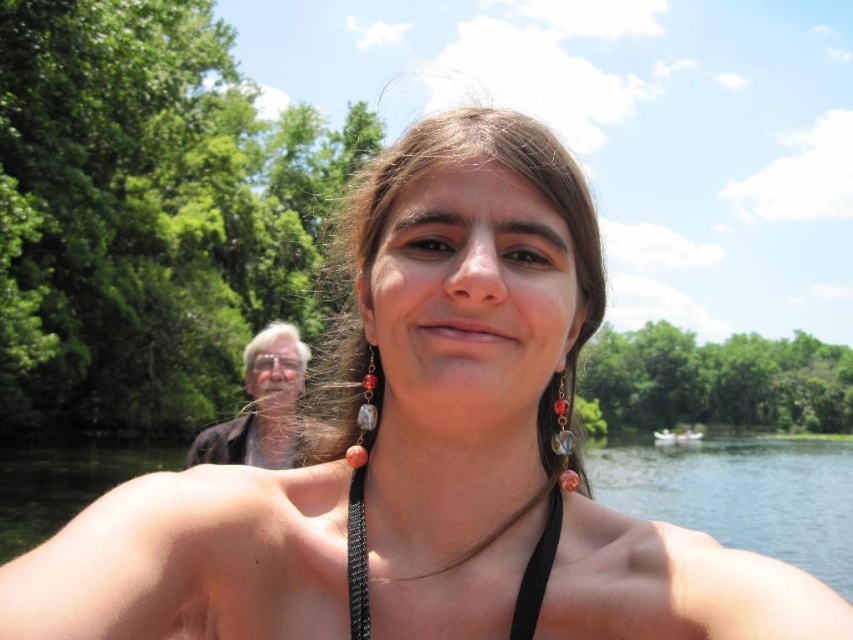
Is clear water at center above black mesh bikini top at center?

No.

Between clear water at center and black mesh bikini top at center, which one appears on the right side from the viewer's perspective?

clear water at center

You are a GUI agent. You are given a task and a screenshot of the screen. Output one action in this format:
    pyautogui.click(x=<x>, y=<y>)
    Task: Click on the clear water at center
    This screenshot has width=853, height=640.
    Given the screenshot: What is the action you would take?
    pyautogui.click(x=741, y=493)

Find the location of a particular element. The image size is (853, 640). clear water at center is located at coordinates (741, 493).

Does black mesh bikini top at center have a lesser height compared to white plastic boat at lower right?

Yes.

Is black mesh bikini top at center closer to camera compared to white plastic boat at lower right?

Yes, black mesh bikini top at center is in front of white plastic boat at lower right.

This screenshot has width=853, height=640. What do you see at coordinates (537, 570) in the screenshot?
I see `black mesh bikini top at center` at bounding box center [537, 570].

The image size is (853, 640). What are the coordinates of `black mesh bikini top at center` in the screenshot? It's located at (537, 570).

Does clear water at center have a lesser height compared to white plastic boat at lower right?

No.

Is point (815, 515) positioned before point (677, 442)?

Yes, it is.

The height and width of the screenshot is (640, 853). I want to click on clear water at center, so click(741, 493).